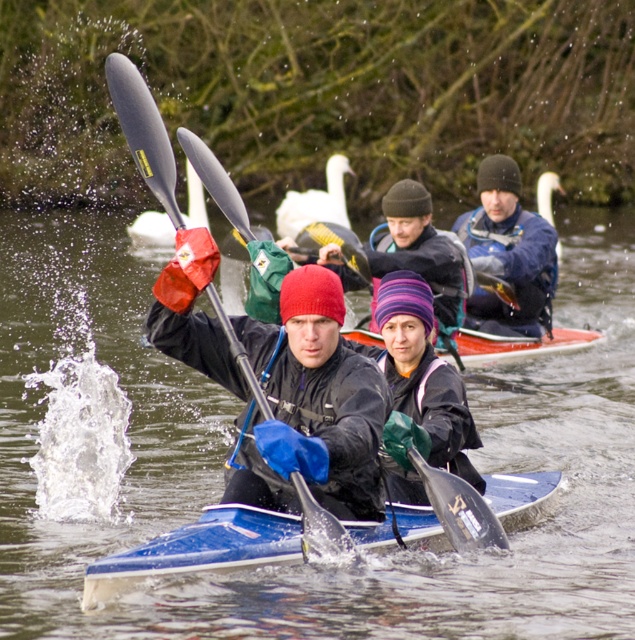
Question: Which is nearer to the clear water at center?

Choices:
 (A) white feathered swan at upper center
 (B) blue waterproof jacket at center
 (C) white fluffy swan at upper center

Answer: (B)

Question: From the image, what is the correct spatial relationship of matte black paddle at left in relation to white fluffy swan at upper center?

Choices:
 (A) left
 (B) right

Answer: (A)

Question: Which of these objects is positioned closest to the matte black jacket at center?

Choices:
 (A) purple striped knit hat at center
 (B) white feathered swan at upper center
 (C) matte black paddle at left
 (D) clear water at center

Answer: (C)

Question: Does matte black jacket at center appear on the right side of purple knit hat at center?

Choices:
 (A) no
 (B) yes

Answer: (A)

Question: Which of these objects is positioned farthest from the matte black paddle at left?

Choices:
 (A) purple knit hat at center
 (B) matte black jacket at center
 (C) orange plastic canoe at center
 (D) blue waterproof jacket at center

Answer: (D)

Question: Is matte black jacket at center wider than orange plastic canoe at center?

Choices:
 (A) yes
 (B) no

Answer: (B)